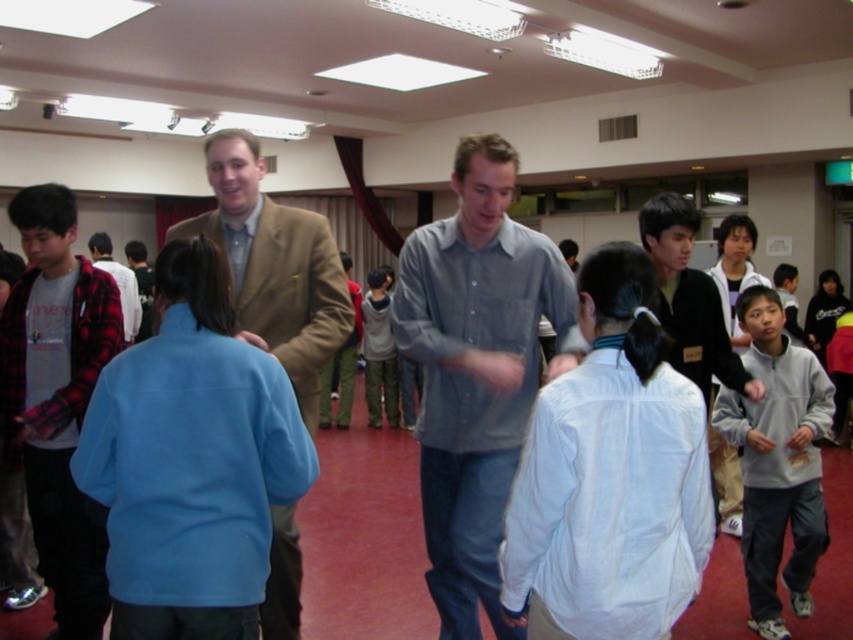
Question: Is white matte shirt at center behind plaid flannel shirt at left?

Choices:
 (A) no
 (B) yes

Answer: (A)

Question: Is gray cotton shirt at center positioned before plaid flannel shirt at left?

Choices:
 (A) no
 (B) yes

Answer: (B)

Question: Estimate the real-world distances between objects in this image. Which object is closer to the matte brown blazer at center?

Choices:
 (A) plaid flannel shirt at left
 (B) light gray sweater at center
 (C) flannel shirt at left
 (D) white matte shirt at center

Answer: (D)

Question: Which point is farther to the camera?

Choices:
 (A) 381,360
 (B) 15,566
 (C) 294,337

Answer: (A)

Question: Is gray cotton shirt at center thinner than matte brown blazer at center?

Choices:
 (A) yes
 (B) no

Answer: (A)

Question: Which of the following is the closest to the observer?

Choices:
 (A) (7, 269)
 (B) (373, 426)
 (C) (421, 467)
 (D) (606, 365)

Answer: (D)